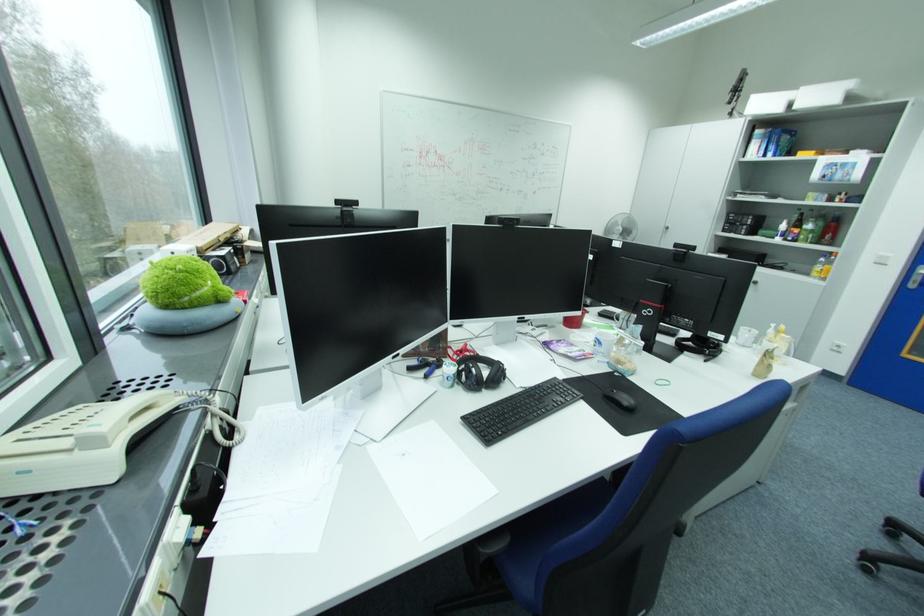
Image resolution: width=924 pixels, height=616 pixels. What do you see at coordinates (762, 289) in the screenshot? I see `the silver cabinet handle` at bounding box center [762, 289].